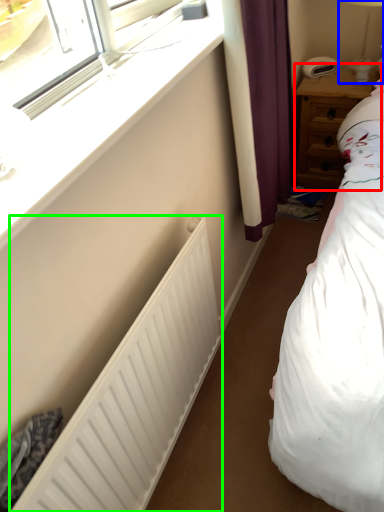
Question: Which object is positioned farthest from nightstand (highlighted by a red box)? Select from bedside lamp (highlighted by a blue box) and radiator (highlighted by a green box).

Choices:
 (A) bedside lamp
 (B) radiator

Answer: (B)